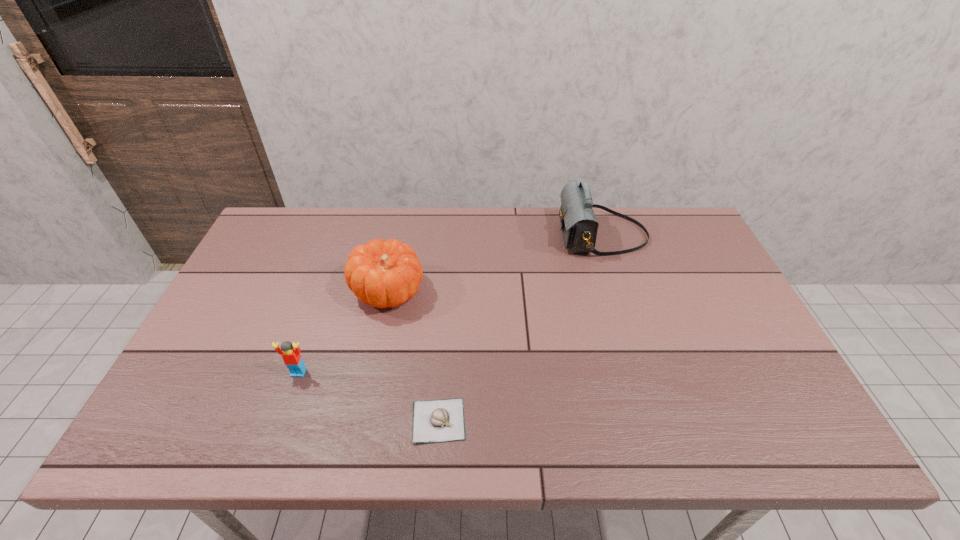
The image size is (960, 540). I want to click on free space that is in between the farthest object and the second object from right to left, so click(x=520, y=328).

Where is `free space between the second tallest object and the third tallest object`? This screenshot has height=540, width=960. free space between the second tallest object and the third tallest object is located at coordinates (344, 332).

Identify the location of blank region between the rightmost object and the garlic. Image resolution: width=960 pixels, height=540 pixels. (520, 328).

This screenshot has height=540, width=960. Find the location of `vacant area that lies between the leftmost object and the nearest object`. vacant area that lies between the leftmost object and the nearest object is located at coordinates (369, 396).

Where is `vacant area between the pumpkin and the garlic`? The width and height of the screenshot is (960, 540). vacant area between the pumpkin and the garlic is located at coordinates (414, 356).

Locate an element on the screen. free space between the second shortest object and the second farthest object is located at coordinates (344, 332).

You are a GUI agent. You are given a task and a screenshot of the screen. Output one action in this format:
    pyautogui.click(x=<x>, y=<y>)
    Task: Click on the blank region between the second farthest object and the shortest object
    Image resolution: width=960 pixels, height=540 pixels.
    Given the screenshot: What is the action you would take?
    414,356

What are the coordinates of `free space between the second shortest object and the tallest object` in the screenshot? It's located at click(450, 303).

Where is `free space between the leftmost object and the farthest object`? free space between the leftmost object and the farthest object is located at coordinates (450, 303).

Select which object appears as the second closest to the shortest object. Please provide its 2D coordinates. Your answer should be formatted as a tuple, i.e. [(x, y)], where the tuple contains the x and y coordinates of a point satisfying the conditions above.

[(291, 356)]